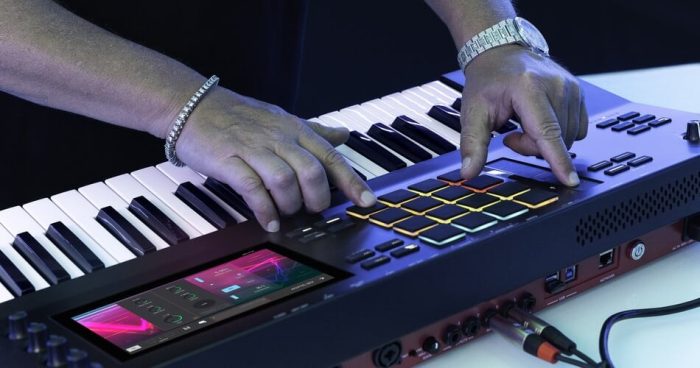
Locate an element on the screen. This screenshot has height=368, width=700. knobs is located at coordinates (15, 322), (35, 331), (50, 345), (75, 355), (92, 362), (690, 126).